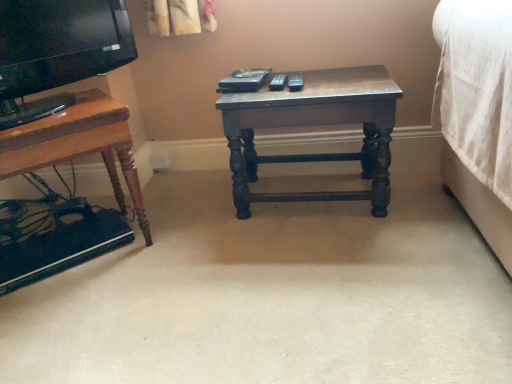
Question: Would you say wooden table at left, the first table from the left, is to the left or to the right of dark wood table at center, the 2th table when ordered from left to right, in the picture?

Choices:
 (A) right
 (B) left

Answer: (B)

Question: From their relative heights in the image, would you say wooden table at left, placed as the second table when sorted from right to left, is taller or shorter than dark wood table at center, the 2th table when ordered from left to right?

Choices:
 (A) tall
 (B) short

Answer: (A)

Question: From the image's perspective, is wooden table at left, the first table from the left, positioned above or below dark wood table at center, marked as the first table in a right-to-left arrangement?

Choices:
 (A) below
 (B) above

Answer: (A)

Question: In the image, is dark wood table at center, marked as the first table in a right-to-left arrangement, positioned in front of or behind wooden table at left, placed as the second table when sorted from right to left?

Choices:
 (A) front
 (B) behind

Answer: (B)

Question: Is point (376, 145) positioned closer to the camera than point (112, 153)?

Choices:
 (A) farther
 (B) closer

Answer: (B)

Question: From the image's perspective, relative to wooden table at left, the first table from the left, is dark wood table at center, the 2th table when ordered from left to right, above or below?

Choices:
 (A) below
 (B) above

Answer: (B)

Question: Is dark wood table at center, marked as the first table in a right-to-left arrangement, taller or shorter than wooden table at left, placed as the second table when sorted from right to left?

Choices:
 (A) tall
 (B) short

Answer: (B)